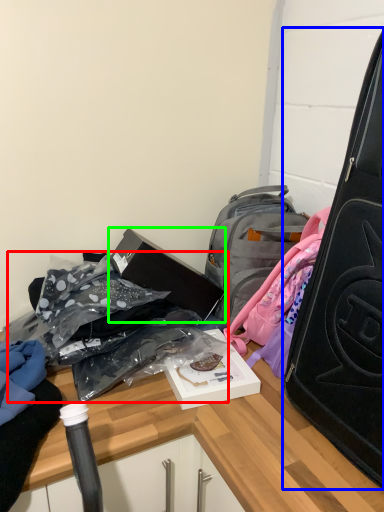
Question: Which object is the farthest from bag (highlighted by a red box)? Choose among these: suitcase (highlighted by a blue box) or box (highlighted by a green box).

Choices:
 (A) suitcase
 (B) box

Answer: (A)